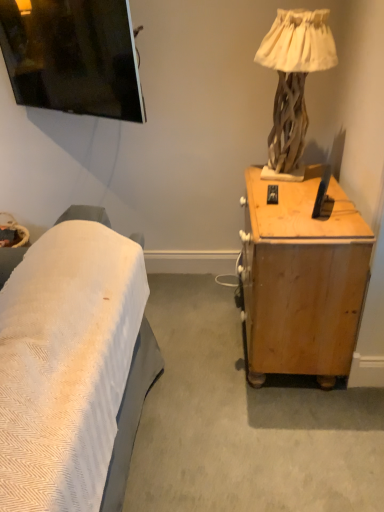
What are the coordinates of `blank space to the left of wooden desk at right` in the screenshot? It's located at (193, 340).